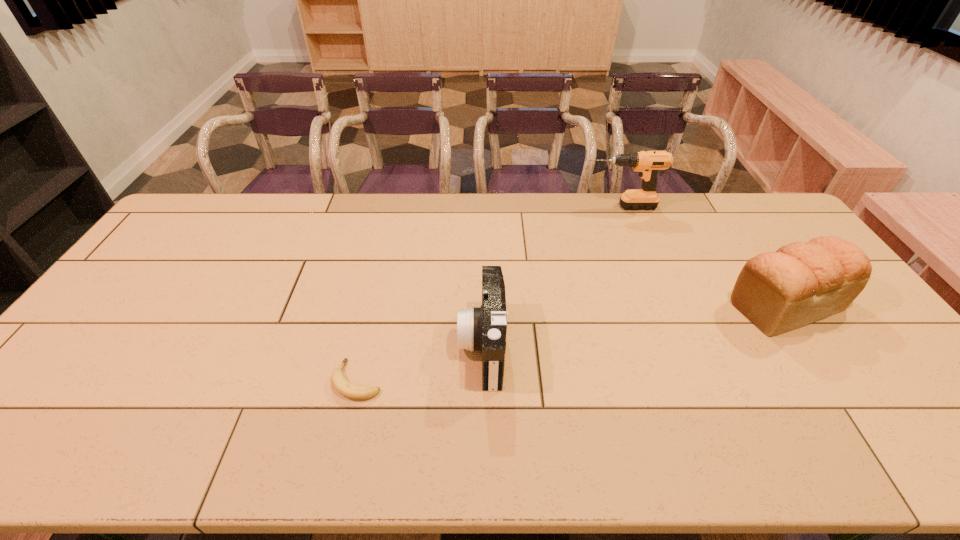
I want to click on vacant space that's between the bread and the shortest object, so click(572, 342).

The width and height of the screenshot is (960, 540). Find the location of `vacant area that lies between the bread and the third object from right to left`. vacant area that lies between the bread and the third object from right to left is located at coordinates (635, 325).

At what (x,y) coordinates should I click in order to perform the action: click on free point between the banana and the bread. Please return your answer as a coordinate pair (x, y). The width and height of the screenshot is (960, 540). Looking at the image, I should click on (572, 342).

Locate an element on the screen. This screenshot has height=540, width=960. vacant area that lies between the camcorder and the farthest object is located at coordinates (551, 276).

The image size is (960, 540). I want to click on vacant region between the second object from right to left and the bread, so click(703, 255).

Find the location of `vacant space in between the rightmost object and the second object from right to left`. vacant space in between the rightmost object and the second object from right to left is located at coordinates (703, 255).

Identify the location of free point between the drill and the camcorder. (551, 276).

The width and height of the screenshot is (960, 540). I want to click on object that ranks as the third closest to the drill, so click(x=339, y=382).

The image size is (960, 540). I want to click on object that is the third nearest to the third tallest object, so click(802, 282).

The width and height of the screenshot is (960, 540). I want to click on free space that satisfies the following two spatial constraints: 1. on the back side of the rightmost object; 2. at the tip of the third object from left to right, so click(721, 207).